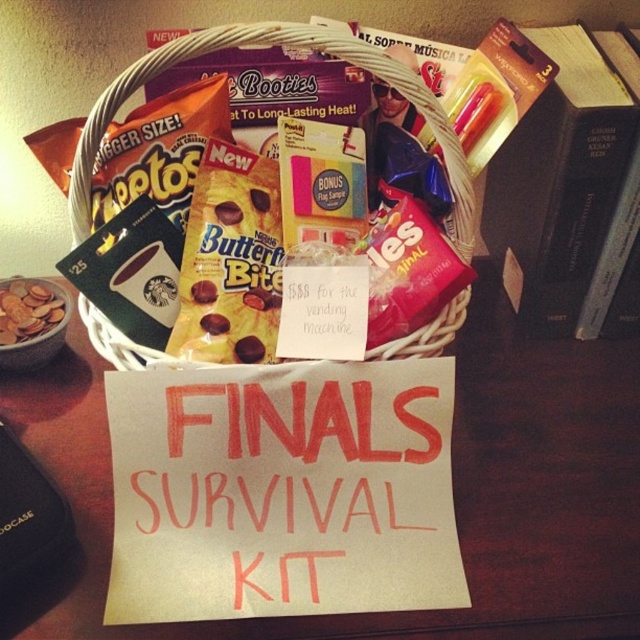
Question: Is wooden table at center positioned in front of white wicker basket at center?

Choices:
 (A) yes
 (B) no

Answer: (B)

Question: Is wooden table at center bigger than white wicker basket at center?

Choices:
 (A) yes
 (B) no

Answer: (A)

Question: Which point is farther from the camera taking this photo?

Choices:
 (A) (6, 300)
 (B) (536, 433)
 (C) (438, 330)

Answer: (A)

Question: Is wooden table at center closer to the viewer compared to white wicker basket at center?

Choices:
 (A) yes
 (B) no

Answer: (B)

Question: Estimate the real-world distances between objects in this image. Which object is closer to the matte brown cookies at lower left?

Choices:
 (A) wooden table at center
 (B) white wicker basket at center

Answer: (B)

Question: Which point is farther to the camera?

Choices:
 (A) wooden table at center
 (B) white wicker basket at center
 (C) matte brown cookies at lower left

Answer: (C)